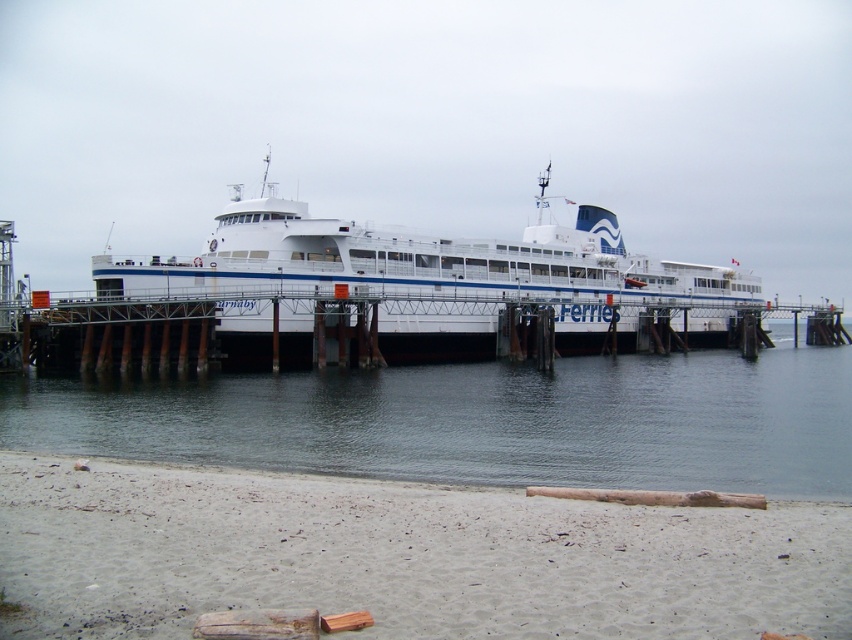
Does point (498, 576) lie in front of point (447, 280)?

Yes.

Between smooth sand beach at lower center and white matte ferry at center, which one has less height?

smooth sand beach at lower center

The width and height of the screenshot is (852, 640). I want to click on smooth sand beach at lower center, so click(401, 556).

Does clear water at center have a larger size compared to white matte ferry at center?

No, clear water at center is not bigger than white matte ferry at center.

Is the position of clear water at center less distant than that of white matte ferry at center?

Yes, clear water at center is closer to the viewer.

This screenshot has width=852, height=640. Identify the location of clear water at center. (481, 420).

Image resolution: width=852 pixels, height=640 pixels. I want to click on clear water at center, so click(481, 420).

Find the location of a particular element. This screenshot has width=852, height=640. smooth sand beach at lower center is located at coordinates (401, 556).

Can you confirm if smooth sand beach at lower center is shorter than clear water at center?

No, smooth sand beach at lower center is not shorter than clear water at center.

Does point (277, 532) come farther from viewer compared to point (435, 456)?

No, (277, 532) is closer to viewer.

This screenshot has width=852, height=640. Identify the location of smooth sand beach at lower center. (401, 556).